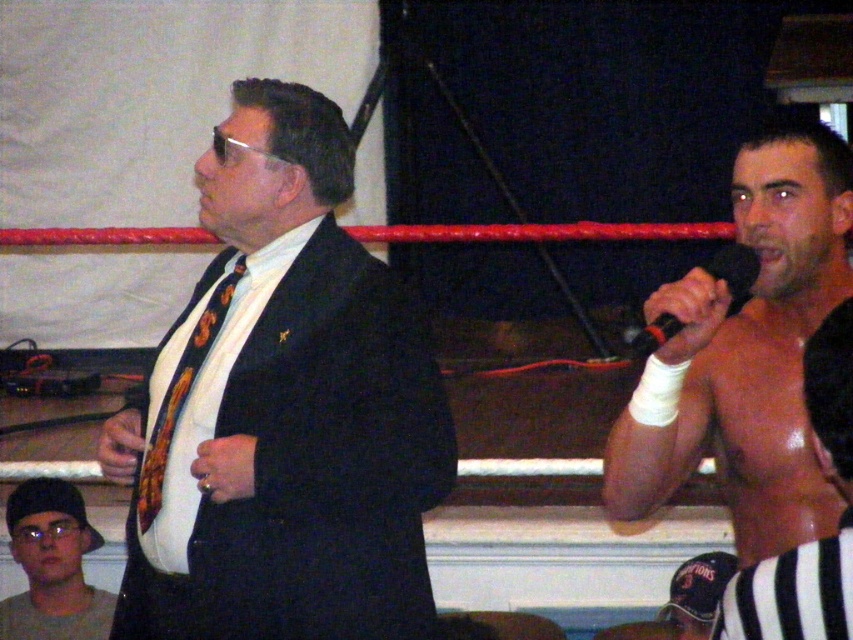
Question: In this image, where is shiny metallic torso at right located relative to black leather cap at lower right?

Choices:
 (A) left
 (B) right

Answer: (A)

Question: Is black leather cap at lower right above black plastic microphone at right?

Choices:
 (A) no
 (B) yes

Answer: (A)

Question: Which object appears farthest from the camera in this image?

Choices:
 (A) matte black cap at lower left
 (B) multicolored silk tie at center
 (C) black plastic microphone at right
 (D) shiny metallic torso at right

Answer: (A)

Question: Does shiny black microphone at right appear over black leather cap at lower right?

Choices:
 (A) yes
 (B) no

Answer: (A)

Question: Which of the following is the farthest from the observer?

Choices:
 (A) (735, 250)
 (B) (198, 480)
 (C) (97, 637)
 (D) (241, 515)

Answer: (C)

Question: Which point appears closest to the camera in this image?

Choices:
 (A) (215, 324)
 (B) (70, 577)
 (C) (334, 186)
 (D) (729, 460)

Answer: (D)